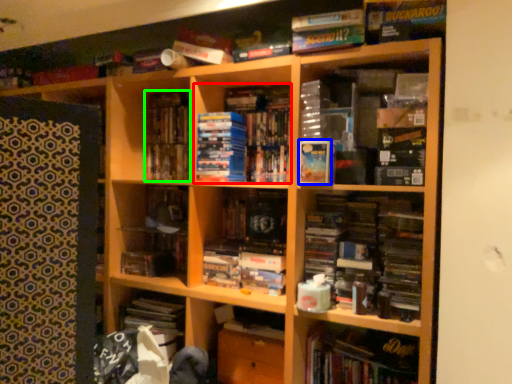
Question: Which is farther away from book (highlighted by a red box)? paperback book (highlighted by a blue box) or book (highlighted by a green box)?

Choices:
 (A) paperback book
 (B) book

Answer: (B)